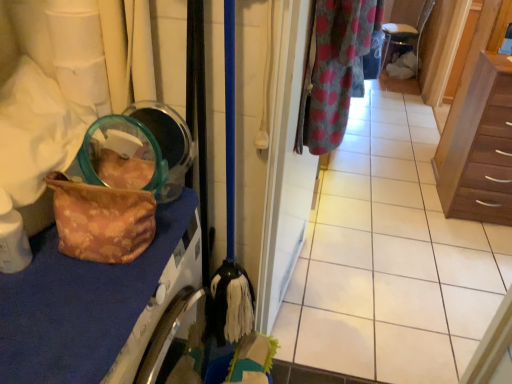
Question: From a real-world perspective, is gray polka dot fabric at upper right beneath polka dot fabric door at center?

Choices:
 (A) no
 (B) yes

Answer: (A)

Question: Considering the relative sizes of gray polka dot fabric at upper right and polka dot fabric door at center in the image provided, is gray polka dot fabric at upper right thinner than polka dot fabric door at center?

Choices:
 (A) yes
 (B) no

Answer: (B)

Question: From the image's perspective, would you say gray polka dot fabric at upper right is positioned over polka dot fabric door at center?

Choices:
 (A) yes
 (B) no

Answer: (A)

Question: Considering the relative sizes of gray polka dot fabric at upper right and polka dot fabric door at center in the image provided, is gray polka dot fabric at upper right taller than polka dot fabric door at center?

Choices:
 (A) yes
 (B) no

Answer: (B)

Question: Considering the relative sizes of gray polka dot fabric at upper right and polka dot fabric door at center in the image provided, is gray polka dot fabric at upper right wider than polka dot fabric door at center?

Choices:
 (A) no
 (B) yes

Answer: (B)

Question: From the image's perspective, is gray polka dot fabric at upper right located above or below brown wood chest of drawers at right?

Choices:
 (A) below
 (B) above

Answer: (B)

Question: From a real-world perspective, relative to brown wood chest of drawers at right, is gray polka dot fabric at upper right vertically above or below?

Choices:
 (A) below
 (B) above

Answer: (B)

Question: Choose the correct answer: Is gray polka dot fabric at upper right inside brown wood chest of drawers at right or outside it?

Choices:
 (A) outside
 (B) inside

Answer: (A)

Question: Visually, is gray polka dot fabric at upper right positioned to the left or to the right of brown wood chest of drawers at right?

Choices:
 (A) right
 (B) left

Answer: (B)

Question: Would you say floral fabric bag at left is inside or outside polka dot fabric door at center?

Choices:
 (A) outside
 (B) inside

Answer: (A)

Question: Considering the positions of floral fabric bag at left and polka dot fabric door at center in the image, is floral fabric bag at left wider or thinner than polka dot fabric door at center?

Choices:
 (A) thin
 (B) wide

Answer: (B)

Question: Is floral fabric bag at left in front of or behind polka dot fabric door at center in the image?

Choices:
 (A) behind
 (B) front

Answer: (B)

Question: From the image's perspective, is floral fabric bag at left located above or below polka dot fabric door at center?

Choices:
 (A) above
 (B) below

Answer: (B)

Question: From the image's perspective, is brown wood chest of drawers at right above or below gray polka dot fabric at upper right?

Choices:
 (A) below
 (B) above

Answer: (A)

Question: From a real-world perspective, is brown wood chest of drawers at right positioned above or below gray polka dot fabric at upper right?

Choices:
 (A) above
 (B) below

Answer: (B)